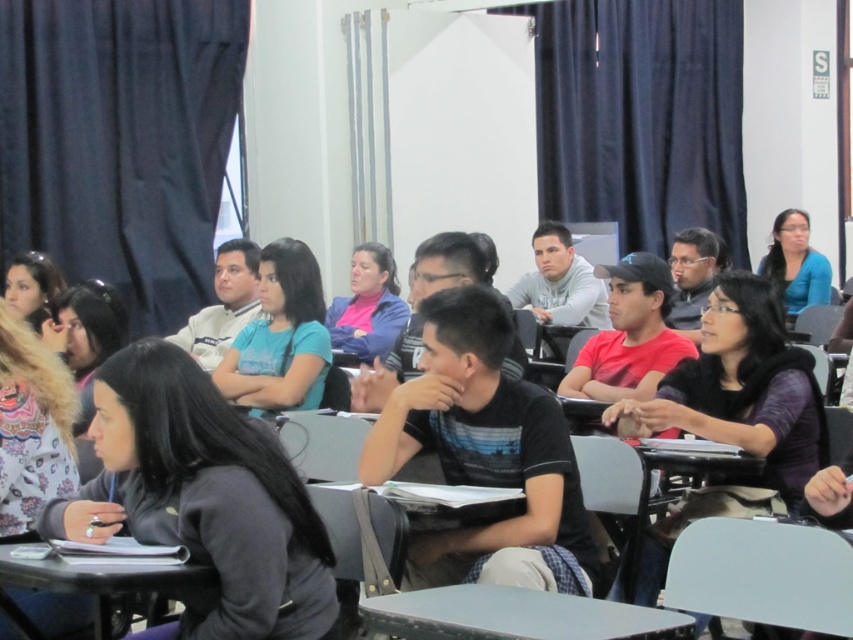
Question: Can you confirm if smooth gray table at center is positioned below smooth plastic table at lower left?

Choices:
 (A) yes
 (B) no

Answer: (A)

Question: Is smooth gray table at center positioned before smooth plastic table at lower left?

Choices:
 (A) yes
 (B) no

Answer: (A)

Question: Is smooth gray table at center below smooth plastic table at lower left?

Choices:
 (A) no
 (B) yes

Answer: (B)

Question: Which point is closer to the camera?

Choices:
 (A) smooth gray table at center
 (B) smooth plastic table at lower left

Answer: (A)

Question: Which point is farther from the camera taking this photo?

Choices:
 (A) (367, 620)
 (B) (36, 570)

Answer: (B)